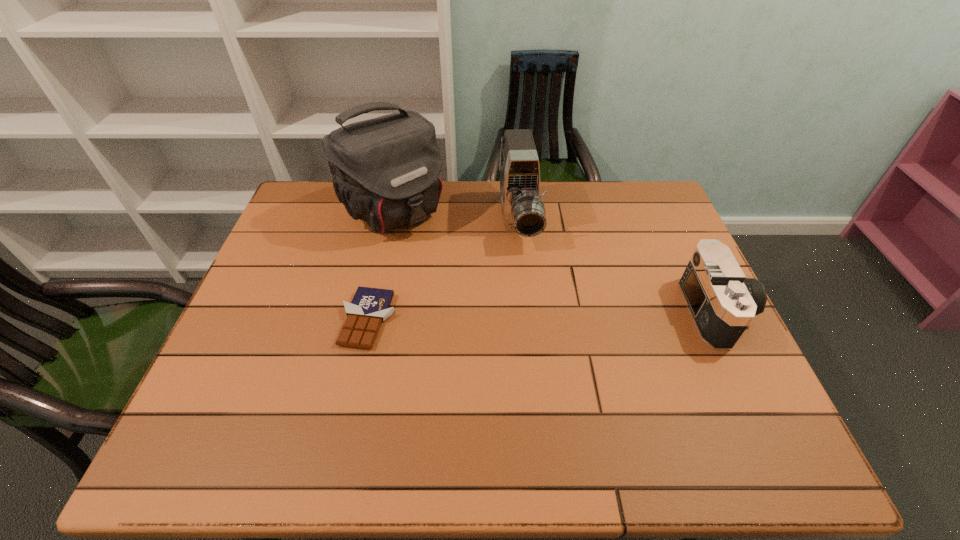
The image size is (960, 540). In the image, there is a desktop. Identify the location of vacant space at the right edge. (669, 354).

In the image, there is a desktop. Identify the location of free region at the far left corner. The width and height of the screenshot is (960, 540). (324, 200).

Locate an element on the screen. vacant region at the near left corner is located at coordinates (253, 394).

Where is `vacant space at the far right corner of the desktop`? Image resolution: width=960 pixels, height=540 pixels. vacant space at the far right corner of the desktop is located at coordinates (657, 190).

You are a GUI agent. You are given a task and a screenshot of the screen. Output one action in this format:
    pyautogui.click(x=<x>, y=<y>)
    Task: Click on the vacant area that lies between the second tallest object and the shoulder bag
    This screenshot has width=960, height=540.
    Given the screenshot: What is the action you would take?
    pyautogui.click(x=456, y=216)

What are the coordinates of `vacant area that lies between the shortest object and the camcorder` in the screenshot? It's located at (444, 270).

Locate an element on the screen. The height and width of the screenshot is (540, 960). vacant area that lies between the second object from right to left and the chocolate bar is located at coordinates (444, 270).

The height and width of the screenshot is (540, 960). What are the coordinates of `free space that is in between the shortest object and the third tallest object` in the screenshot? It's located at (543, 316).

You are a GUI agent. You are given a task and a screenshot of the screen. Output one action in this format:
    pyautogui.click(x=<x>, y=<y>)
    Task: Click on the vacant area that lies between the shortest object and the tallest object
    This screenshot has height=540, width=960.
    Given the screenshot: What is the action you would take?
    pyautogui.click(x=380, y=266)

You are a GUI agent. You are given a task and a screenshot of the screen. Output one action in this format:
    pyautogui.click(x=<x>, y=<y>)
    Task: Click on the free spot between the shortest object and the third tallest object
    
    Given the screenshot: What is the action you would take?
    pyautogui.click(x=543, y=316)